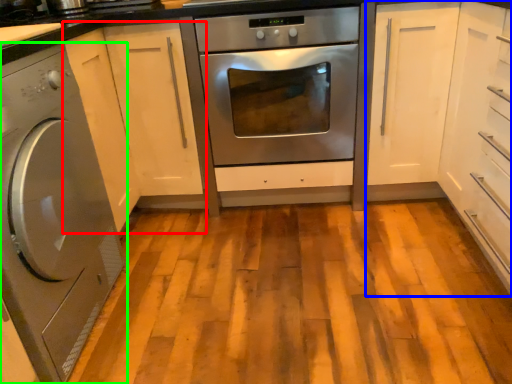
Question: Which object is the closest to the cabinetry (highlighted by a red box)? Choose among these: cabinetry (highlighted by a blue box) or washing machine (highlighted by a green box).

Choices:
 (A) cabinetry
 (B) washing machine

Answer: (B)